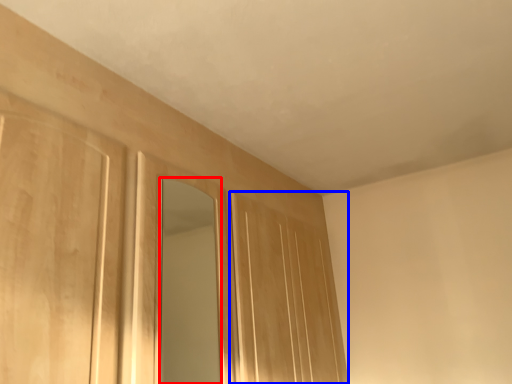
Question: Which object is further to the camera taking this photo, mirror (highlighted by a red box) or door (highlighted by a blue box)?

Choices:
 (A) mirror
 (B) door

Answer: (B)